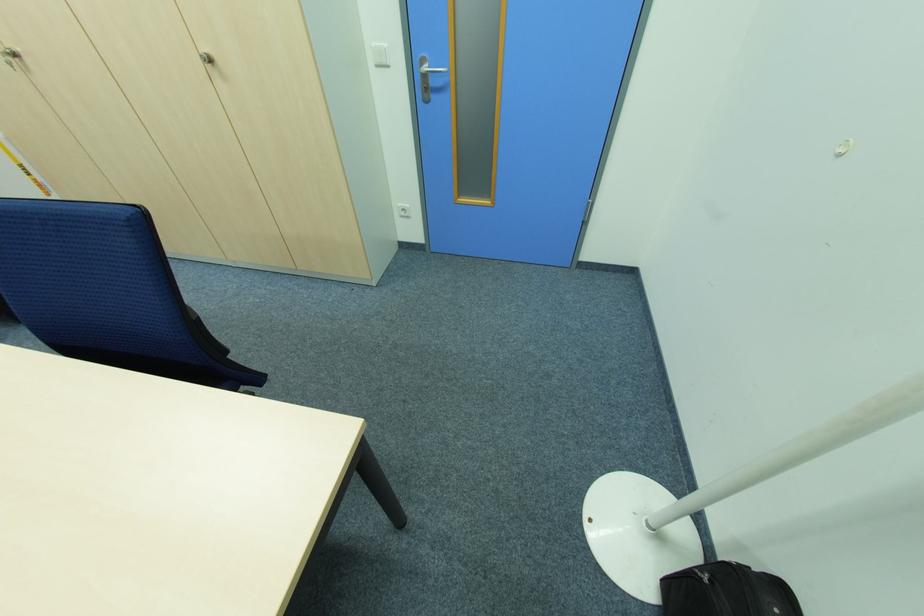
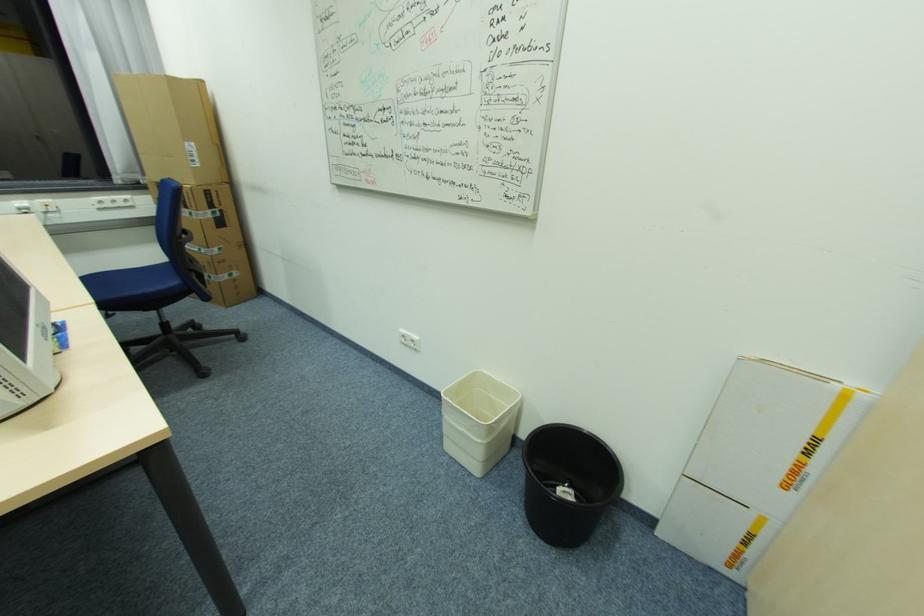
In the second image, find the point that corresponds to (43,185) in the first image.

(797, 472)